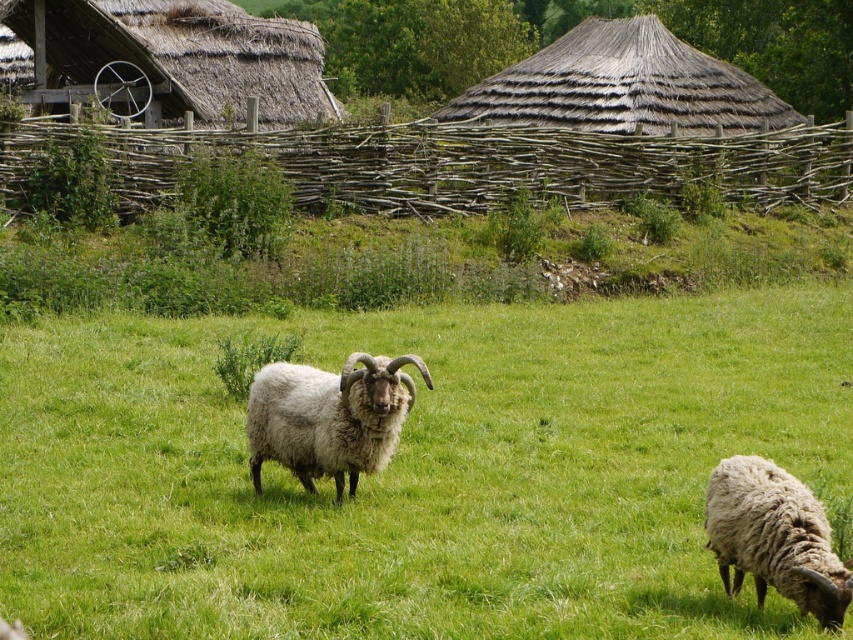
Is thatched straw hut at upper left taller than white woolly sheep at lower right?

Correct, thatched straw hut at upper left is much taller as white woolly sheep at lower right.

Is the position of thatched straw hut at upper left more distant than that of white woolly sheep at lower right?

Yes, it is behind white woolly sheep at lower right.

What do you see at coordinates (166, 60) in the screenshot?
I see `thatched straw hut at upper left` at bounding box center [166, 60].

Identify the location of thatched straw hut at upper left. (166, 60).

Which of these two, brown wooden fence at upper center or thatched straw hut at upper center, stands shorter?

Standing shorter between the two is brown wooden fence at upper center.

Is point (498, 180) closer to camera compared to point (573, 96)?

Yes, it is in front of point (573, 96).

Find the location of a particular element. This screenshot has width=853, height=640. brown wooden fence at upper center is located at coordinates (460, 163).

Does brown wooden fence at upper center come behind thatched straw hut at upper left?

No, it is not.

Between brown wooden fence at upper center and thatched straw hut at upper left, which one appears on the left side from the viewer's perspective?

From the viewer's perspective, thatched straw hut at upper left appears more on the left side.

Does point (602, 196) come closer to viewer compared to point (252, 19)?

Yes, point (602, 196) is in front of point (252, 19).

Image resolution: width=853 pixels, height=640 pixels. I want to click on brown wooden fence at upper center, so click(460, 163).